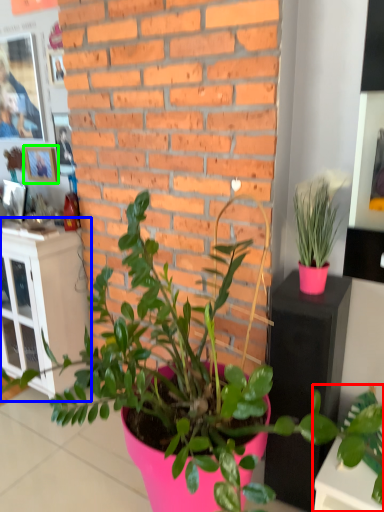
Question: Considering the real-world distances, which object is farthest from houseplant (highlighted by a red box)? file cabinet (highlighted by a blue box) or picture frame (highlighted by a green box)?

Choices:
 (A) file cabinet
 (B) picture frame

Answer: (B)